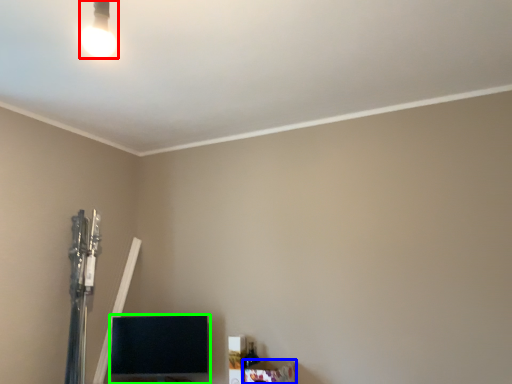
Question: Which object is positioned farthest from lamp (highlighted by a red box)? Select from furniture (highlighted by a blue box) and furniture (highlighted by a green box).

Choices:
 (A) furniture
 (B) furniture

Answer: (A)